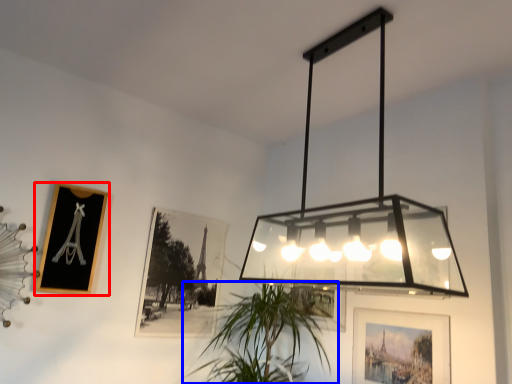
Question: Which of the following is the farthest to the observer, picture frame (highlighted by a red box) or houseplant (highlighted by a blue box)?

Choices:
 (A) picture frame
 (B) houseplant

Answer: (A)